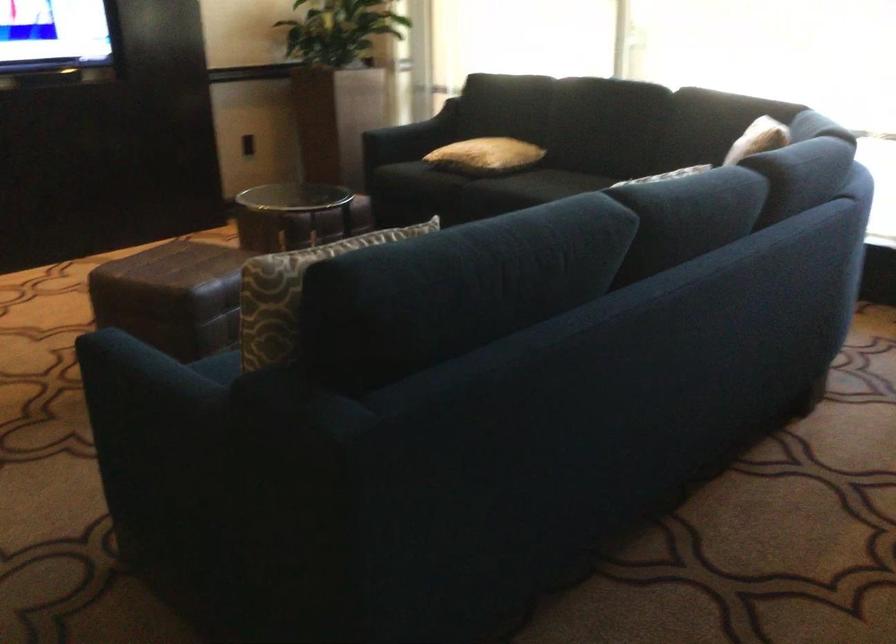
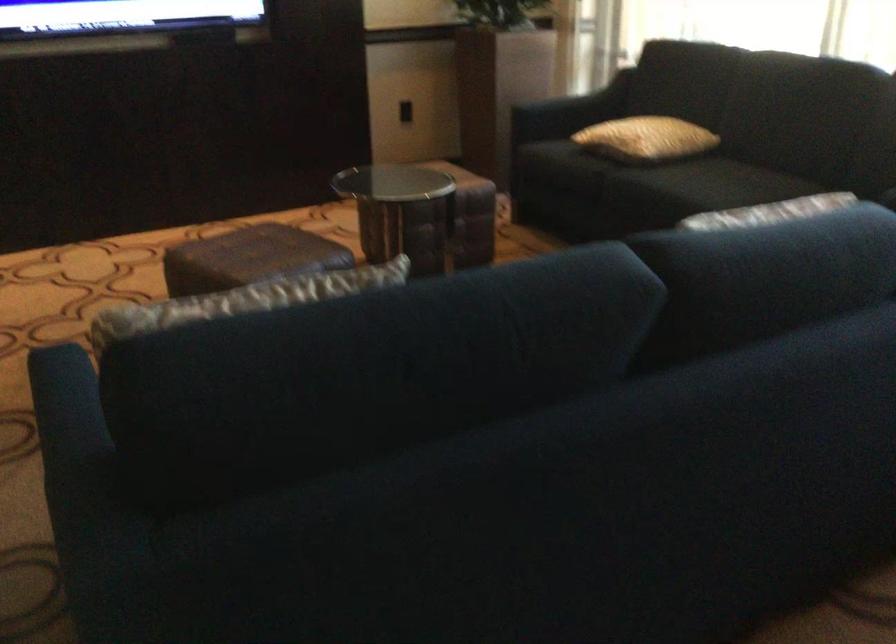
The point at (553, 185) is marked in the first image. Where is the corresponding point in the second image?

(709, 184)